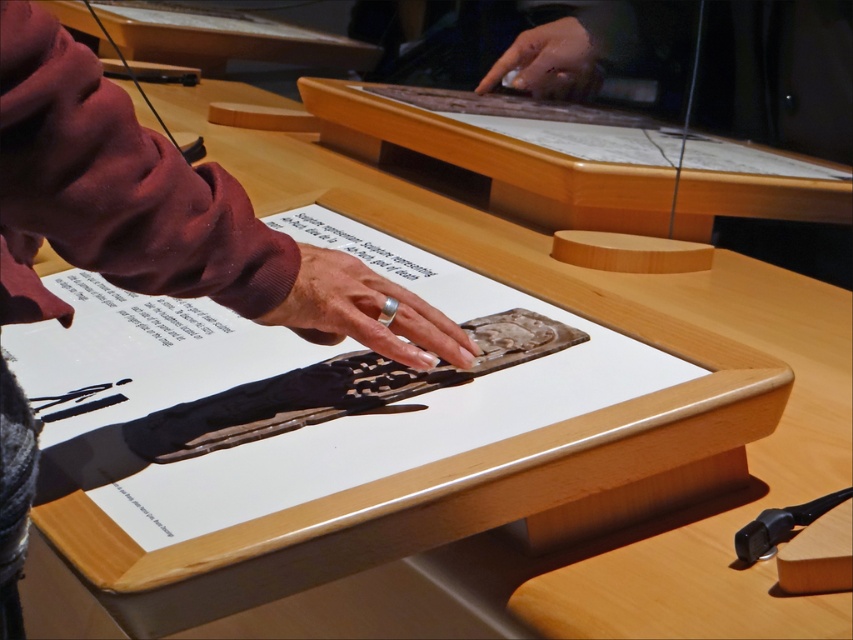
You are a museum guide holding a 10 inch long measuring tape. You need to measure the gap between the wooden table at center and the smooth skin hand at upper center. Can your measuring tape reach the entire distance?

The distance between the wooden table at center and the smooth skin hand at upper center is 11.76 inches. Since the measuring tape is only 10 inches long, it cannot fully reach the entire distance.

Consider the image. You are a museum guide standing at the entrance of the exhibit. You need to place a new artifact on the wooden table at center. Where exactly should you place it?

The wooden table at center is located at point (492,157), so you should place the new artifact there.